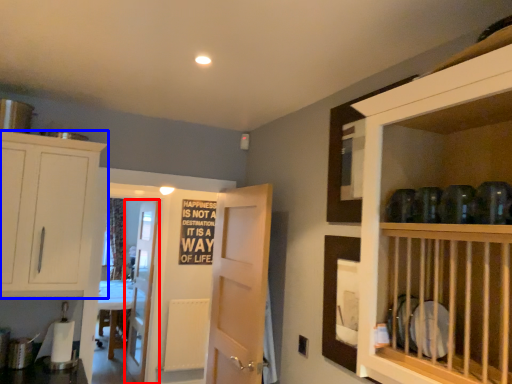
Question: Among these objects, which one is nearest to the camera, door (highlighted by a red box) or cabinetry (highlighted by a blue box)?

Choices:
 (A) door
 (B) cabinetry

Answer: (B)